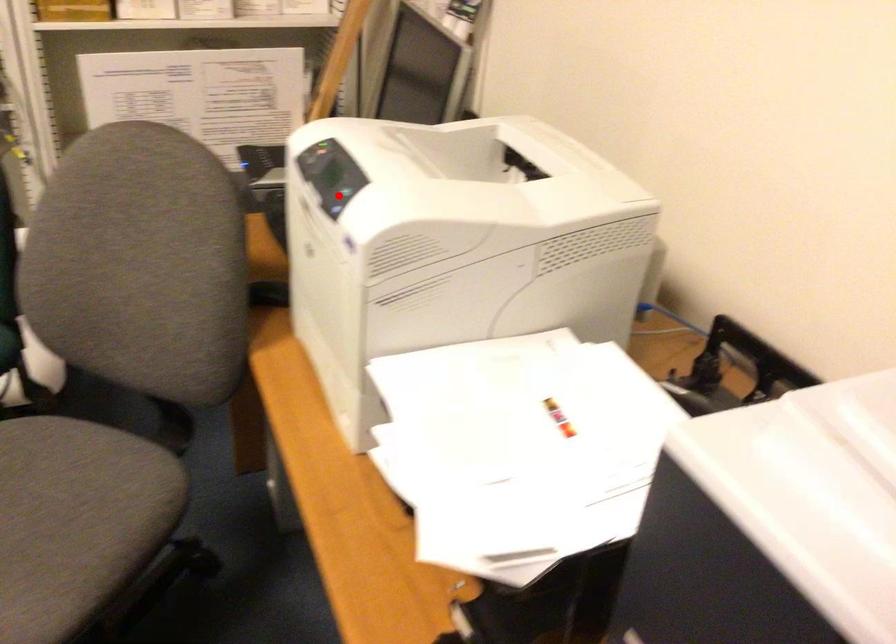
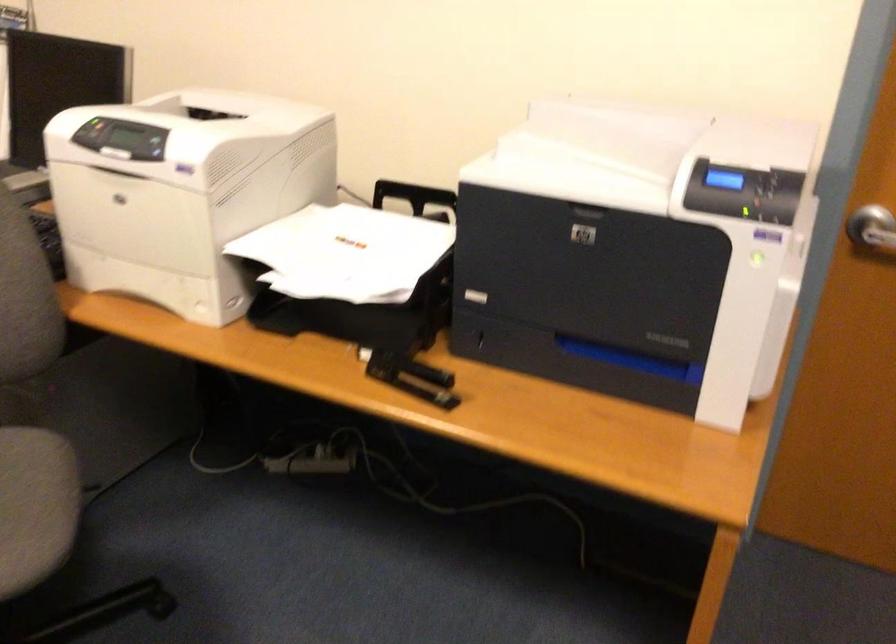
Question: I am providing you with two images of the same scene from different viewpoints. Image1 has a red point marked. In image2, the corresponding 3D location appears at what relative position? Reply with the corresponding letter.

Choices:
 (A) Closer
 (B) Farther

Answer: (B)